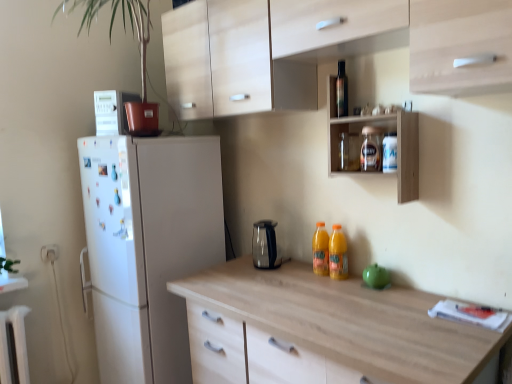
Question: Considering the relative positions of white plastic electric outlet at lower left and clear plastic bottle at upper right, the 3th bottle in the top-to-bottom sequence, in the image provided, is white plastic electric outlet at lower left to the right of clear plastic bottle at upper right, the 3th bottle in the top-to-bottom sequence, from the viewer's perspective?

Choices:
 (A) yes
 (B) no

Answer: (B)

Question: Does white plastic electric outlet at lower left have a larger size compared to clear plastic bottle at upper right, the 3th bottle in the top-to-bottom sequence?

Choices:
 (A) yes
 (B) no

Answer: (B)

Question: Can you confirm if white plastic electric outlet at lower left is smaller than clear plastic bottle at upper right, which appears as the second bottle when ordered from the bottom?

Choices:
 (A) yes
 (B) no

Answer: (A)

Question: Considering the relative positions of white plastic electric outlet at lower left and clear plastic bottle at upper right, which appears as the second bottle when ordered from the bottom, in the image provided, is white plastic electric outlet at lower left to the left of clear plastic bottle at upper right, which appears as the second bottle when ordered from the bottom, from the viewer's perspective?

Choices:
 (A) yes
 (B) no

Answer: (A)

Question: Does white plastic electric outlet at lower left lie behind clear plastic bottle at upper right, the 3th bottle in the top-to-bottom sequence?

Choices:
 (A) yes
 (B) no

Answer: (A)

Question: Is point (374, 279) closer or farther from the camera than point (136, 112)?

Choices:
 (A) farther
 (B) closer

Answer: (B)

Question: Considering their positions, is green matte apple at center, positioned as the third appliance in top-to-bottom order, located in front of or behind green matte plant at upper left?

Choices:
 (A) front
 (B) behind

Answer: (B)

Question: Is green matte apple at center, which is the third appliance in back-to-front order, taller or shorter than green matte plant at upper left?

Choices:
 (A) short
 (B) tall

Answer: (A)

Question: Is green matte apple at center, which is the third appliance in back-to-front order, situated inside green matte plant at upper left or outside?

Choices:
 (A) outside
 (B) inside

Answer: (A)

Question: Does point (380, 155) appear closer or farther from the camera than point (42, 248)?

Choices:
 (A) farther
 (B) closer

Answer: (B)

Question: Based on their sizes in the image, would you say transparent glass jar at upper center, the third bottle positioned from the bottom, is bigger or smaller than white plastic electric outlet at lower left?

Choices:
 (A) big
 (B) small

Answer: (A)

Question: Is transparent glass jar at upper center, the 2th bottle in the top-to-bottom sequence, inside or outside of white plastic electric outlet at lower left?

Choices:
 (A) outside
 (B) inside

Answer: (A)

Question: In the image, is transparent glass jar at upper center, the 2th bottle in the top-to-bottom sequence, on the left side or the right side of white plastic electric outlet at lower left?

Choices:
 (A) right
 (B) left

Answer: (A)

Question: Considering the positions of sleek metallic kettle at center, the second appliance in the right-to-left sequence, and green matte apple at center, positioned as the third appliance in top-to-bottom order, in the image, is sleek metallic kettle at center, the second appliance in the right-to-left sequence, taller or shorter than green matte apple at center, positioned as the third appliance in top-to-bottom order,?

Choices:
 (A) short
 (B) tall

Answer: (B)

Question: Considering the positions of point (271, 236) and point (384, 273), is point (271, 236) closer or farther from the camera than point (384, 273)?

Choices:
 (A) closer
 (B) farther

Answer: (B)